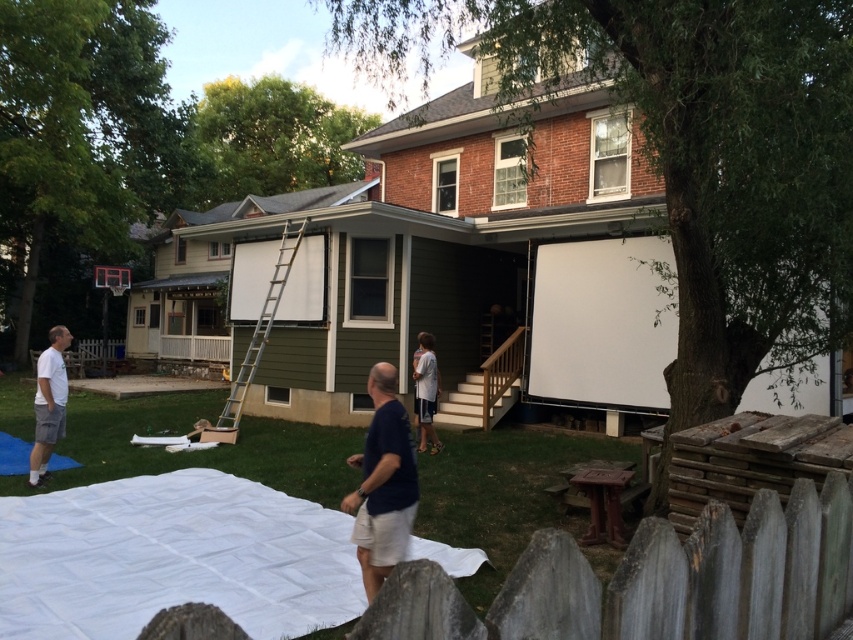
You are standing in the backyard and want to place a small garden statue between the two points, point (392, 412) and point (242, 376). Which point should you place it closer to so it appears larger in the photo?

You should place the garden statue closer to point (392, 412) because it is closer to the viewer, making the statue appear larger in the photo compared to placing it near point (242, 376) which is farther away.

You are standing in the backyard and want to walk from point (228, 428) to point (425, 376). Which direction should you move relative to your current position?

You should move away from the camera because point (425, 376) is further away from the camera than point (228, 428).